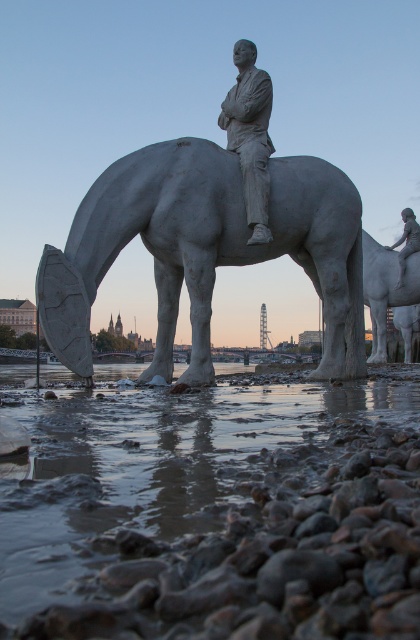
Question: Which of the following is the farthest from the observer?

Choices:
 (A) (351, 568)
 (B) (267, 196)
 (C) (362, 256)

Answer: (C)

Question: Is muddy water at lower center wider than white stone horse at center?

Choices:
 (A) yes
 (B) no

Answer: (A)

Question: Among these objects, which one is farthest from the camera?

Choices:
 (A) white stone horse at center
 (B) muddy water at lower center

Answer: (A)

Question: Is muddy water at lower center positioned in front of white glossy horse at center?

Choices:
 (A) no
 (B) yes

Answer: (B)

Question: Which point is farther to the camera?

Choices:
 (A) (196, 572)
 (B) (411, 212)

Answer: (B)

Question: Can you confirm if muddy water at lower center is smaller than white stone horse at center?

Choices:
 (A) yes
 (B) no

Answer: (B)